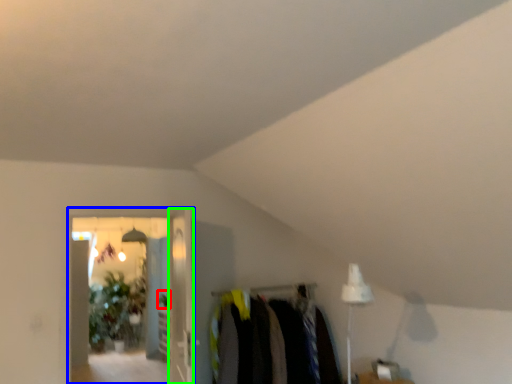
Question: Estimate the real-world distances between objects in this image. Which object is farther from plant (highlighted by a red box), glass door (highlighted by a blue box) or glass door (highlighted by a green box)?

Choices:
 (A) glass door
 (B) glass door

Answer: (A)